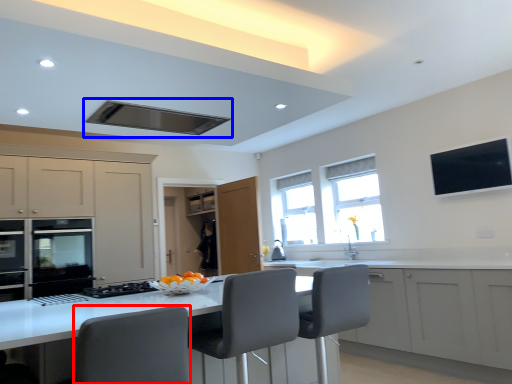
Question: Which point is further to the camera, swivel chair (highlighted by a red box) or exhaust hood (highlighted by a blue box)?

Choices:
 (A) swivel chair
 (B) exhaust hood

Answer: (B)